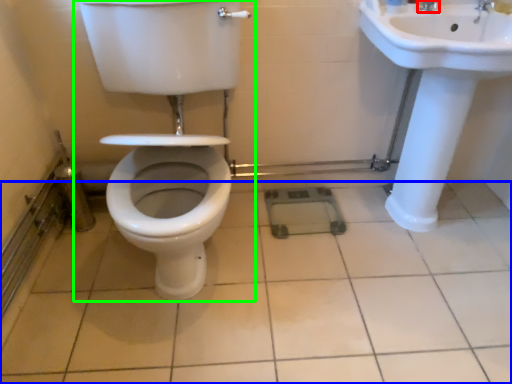
Question: Which is nearer to the tap (highlighted by a red box)? ceramic tile (highlighted by a blue box) or toilet (highlighted by a green box).

Choices:
 (A) ceramic tile
 (B) toilet

Answer: (B)